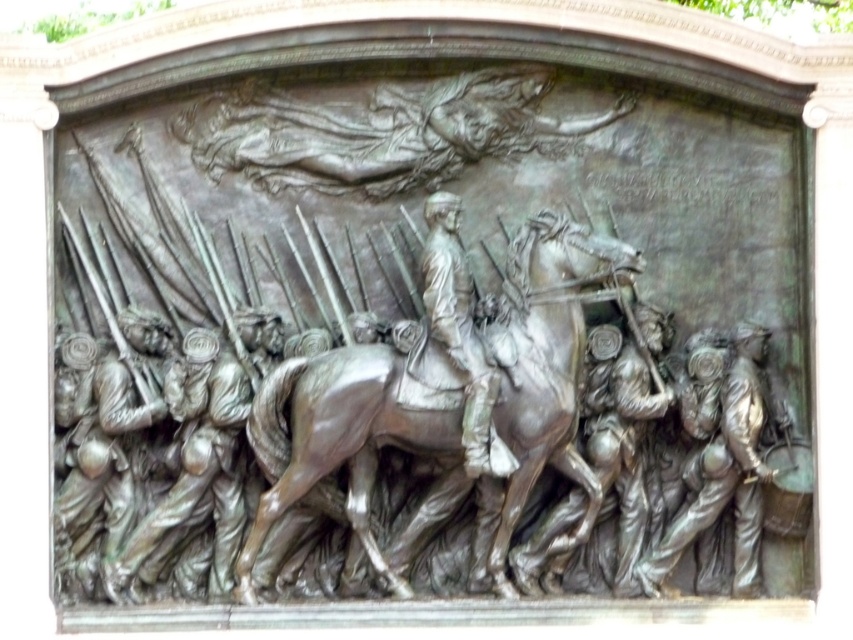
Question: Does shiny bronze horse at center have a lesser width compared to bronze figure at center?

Choices:
 (A) no
 (B) yes

Answer: (A)

Question: Does shiny bronze horse at center have a greater width compared to bronze figure at center?

Choices:
 (A) yes
 (B) no

Answer: (A)

Question: Can you confirm if shiny bronze horse at center is thinner than bronze figure at center?

Choices:
 (A) no
 (B) yes

Answer: (A)

Question: Which object appears closest to the camera in this image?

Choices:
 (A) bronze figure at center
 (B) shiny bronze horse at center

Answer: (A)

Question: Which point is farther from the camera taking this photo?

Choices:
 (A) (532, 385)
 (B) (465, 419)

Answer: (A)

Question: Among these points, which one is farthest from the camera?

Choices:
 (A) (534, 387)
 (B) (448, 262)

Answer: (B)